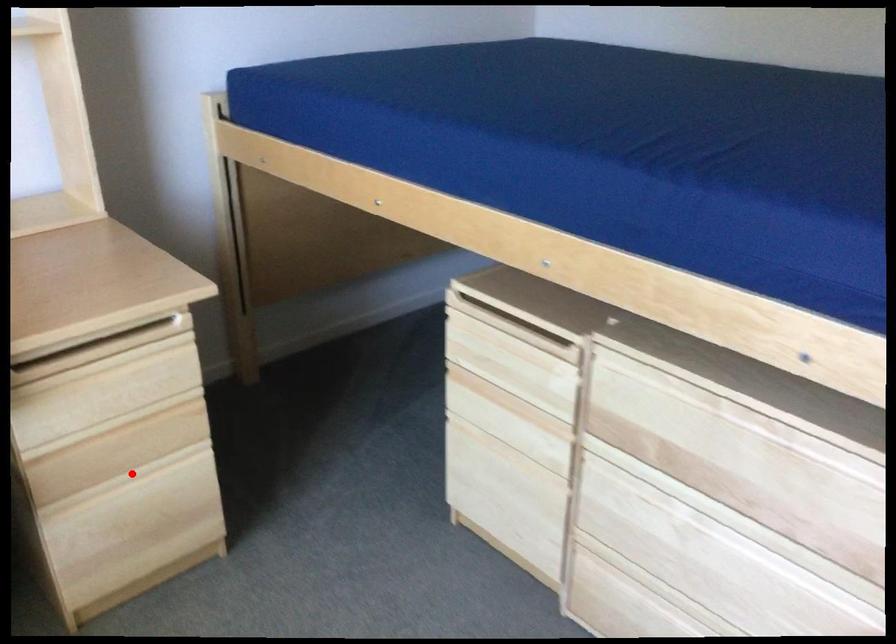
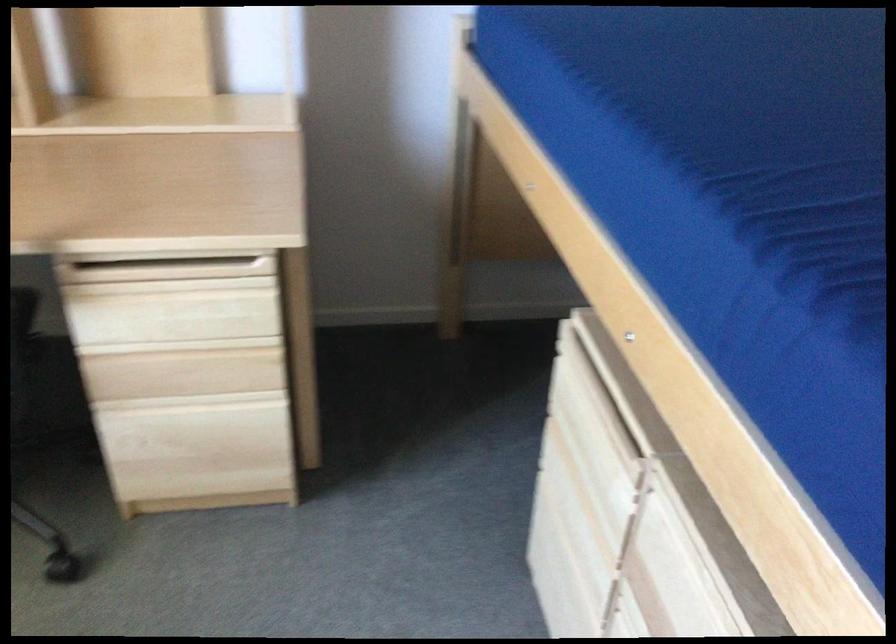
Find the pixel in the second image that matches the highlighted location in the first image.

(192, 401)